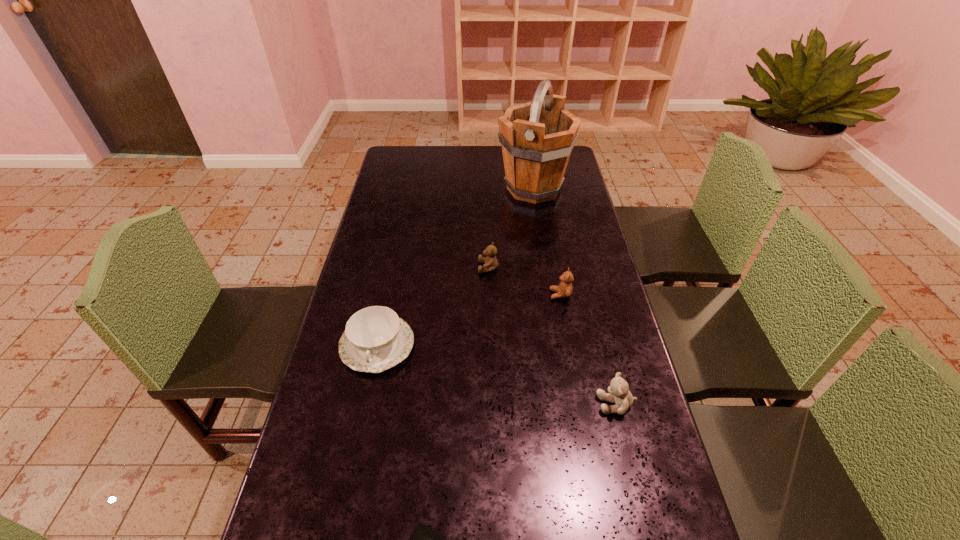
Identify the location of bucket. The width and height of the screenshot is (960, 540). (537, 137).

You are a GUI agent. You are given a task and a screenshot of the screen. Output one action in this format:
    pyautogui.click(x=<x>, y=<y>)
    Task: Click on the tallest object
    The image size is (960, 540).
    Given the screenshot: What is the action you would take?
    pyautogui.click(x=537, y=137)

Find the location of a particular element. This screenshot has height=540, width=960. the second nearest teddy bear is located at coordinates (564, 289).

Where is `the fourth nearest object`? The width and height of the screenshot is (960, 540). the fourth nearest object is located at coordinates (564, 289).

Where is `the nearest teddy bear`? Image resolution: width=960 pixels, height=540 pixels. the nearest teddy bear is located at coordinates (619, 393).

The image size is (960, 540). I want to click on the rightmost teddy bear, so click(x=619, y=393).

The width and height of the screenshot is (960, 540). Identify the location of the fifth nearest object. (490, 261).

You are a GUI agent. You are given a task and a screenshot of the screen. Output one action in this format:
    pyautogui.click(x=<x>, y=<y>)
    Task: Click on the farthest teddy bear
    
    Given the screenshot: What is the action you would take?
    pyautogui.click(x=490, y=261)

Locate an element on the screen. chinaware is located at coordinates (375, 339).

Where is `the third nearest object`? This screenshot has height=540, width=960. the third nearest object is located at coordinates (375, 339).